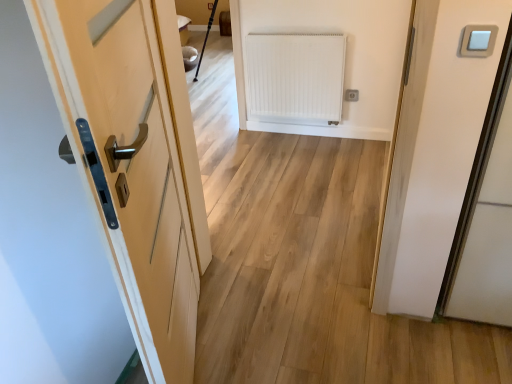
This screenshot has width=512, height=384. What are the coordinates of `vacant space underneath white matte radiator at center (from a real-world perspective)` in the screenshot? It's located at (300, 136).